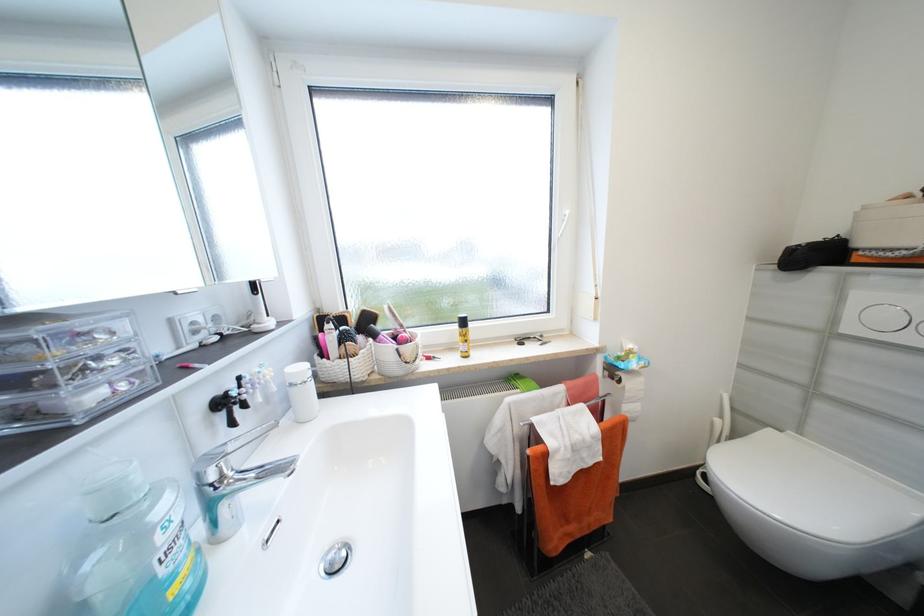
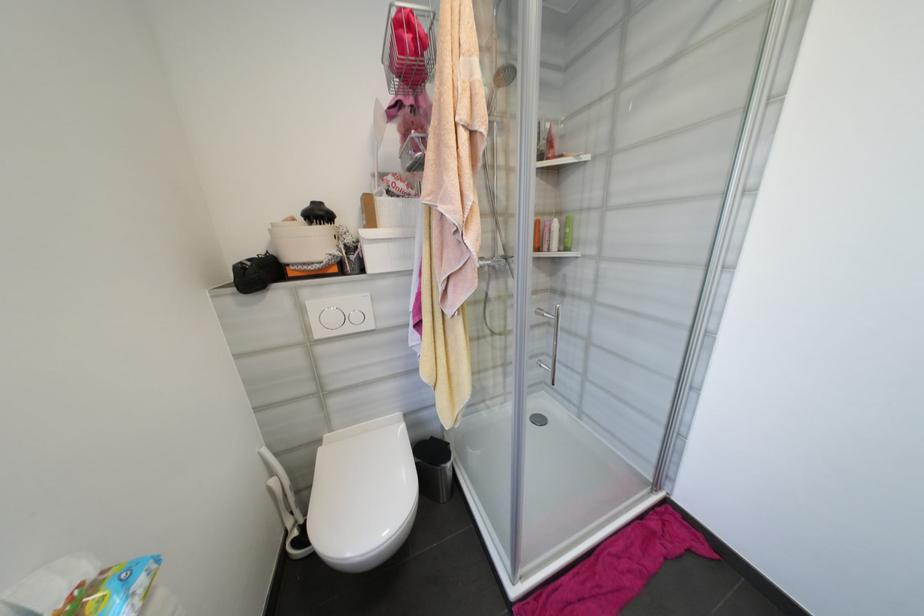
The point at (784, 431) is marked in the first image. Where is the corresponding point in the second image?

(325, 443)